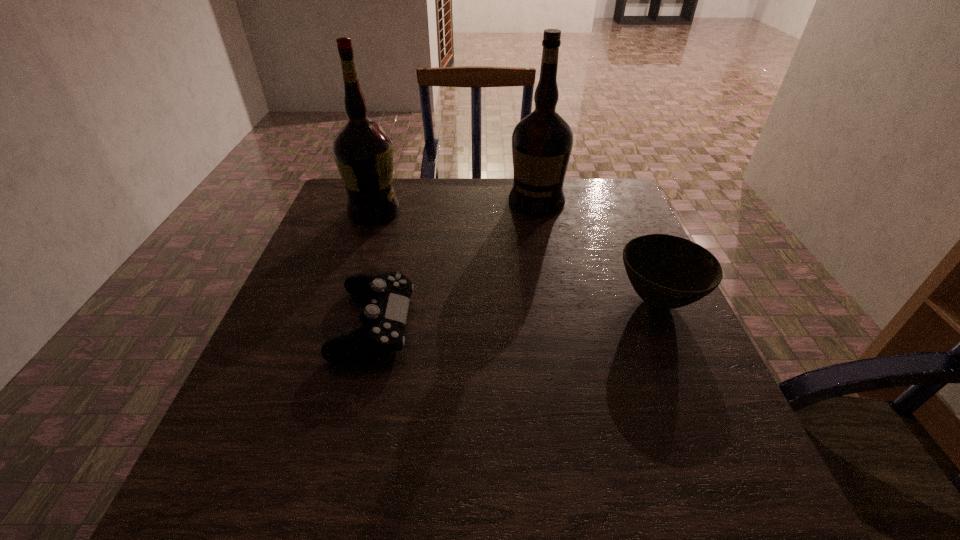
In order to click on control in this screenshot , I will do `click(384, 318)`.

Where is `the rightmost object`? The image size is (960, 540). the rightmost object is located at coordinates (667, 272).

Image resolution: width=960 pixels, height=540 pixels. In order to click on bowl in this screenshot , I will do click(x=667, y=272).

The image size is (960, 540). Find the location of `liquor`. liquor is located at coordinates (542, 142).

The width and height of the screenshot is (960, 540). Identify the location of alcohol. (363, 152).

This screenshot has width=960, height=540. I want to click on vacant area located 0.290m on the surface of the shortest object, so click(x=546, y=323).

Locate an element on the screen. The height and width of the screenshot is (540, 960). free location located 0.080m on the left of the bowl is located at coordinates (579, 301).

Find the location of a particular element. The height and width of the screenshot is (540, 960). free space located on the surface of the liquor is located at coordinates (500, 273).

You are a GUI agent. You are given a task and a screenshot of the screen. Output one action in this format:
    pyautogui.click(x=<x>, y=<y>)
    Task: Click on the vacant space located on the surface of the liquor
    This screenshot has height=540, width=960.
    Given the screenshot: What is the action you would take?
    pyautogui.click(x=483, y=306)

What are the coordinates of `free space located on the surface of the liquor` in the screenshot? It's located at (515, 245).